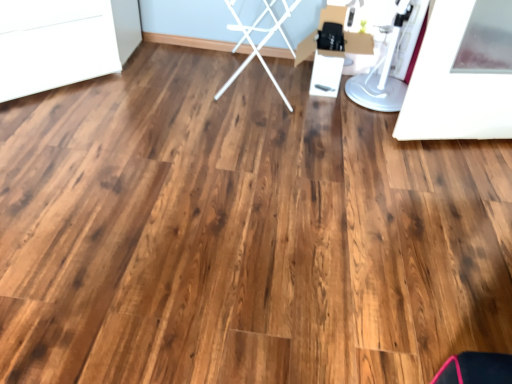
What is the approximate height of white plastic swivel chair at upper right?

white plastic swivel chair at upper right is 20.31 inches tall.

Identify the location of white plastic swivel chair at upper right. (382, 73).

The width and height of the screenshot is (512, 384). What do you see at coordinates (382, 73) in the screenshot? I see `white plastic swivel chair at upper right` at bounding box center [382, 73].

You are a GUI agent. You are given a task and a screenshot of the screen. Output one action in this format:
    pyautogui.click(x=<x>, y=<y>)
    Task: Click on the white plastic swivel chair at upper right
    The width and height of the screenshot is (512, 384).
    Given the screenshot: What is the action you would take?
    pyautogui.click(x=382, y=73)